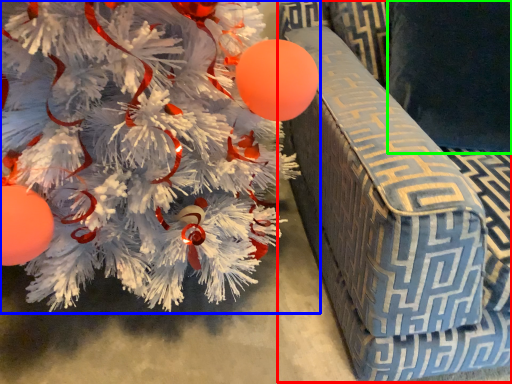
Question: Which object is positioned farthest from armchair (highlighted by a red box)? Select from christmas tree (highlighted by a blue box) and pillow (highlighted by a green box).

Choices:
 (A) christmas tree
 (B) pillow

Answer: (A)